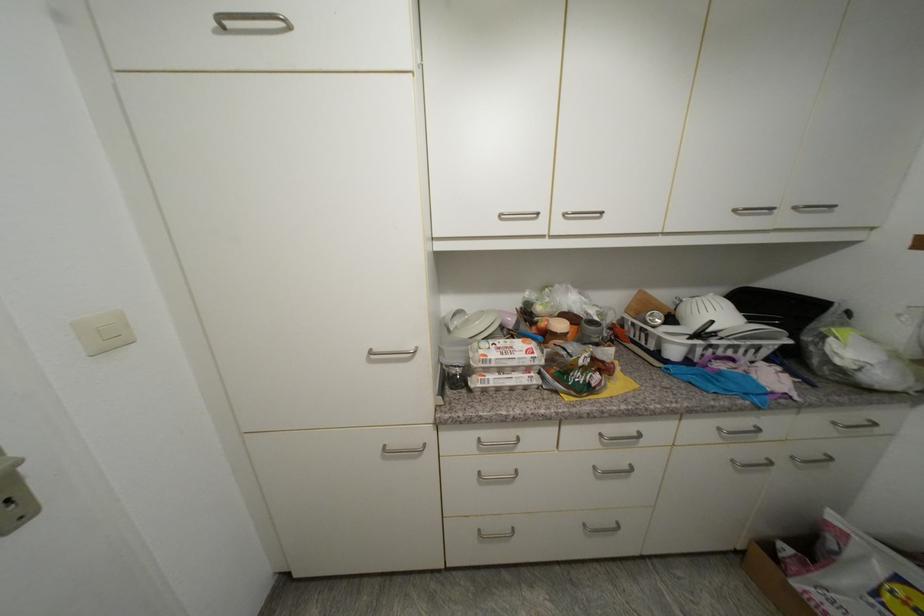
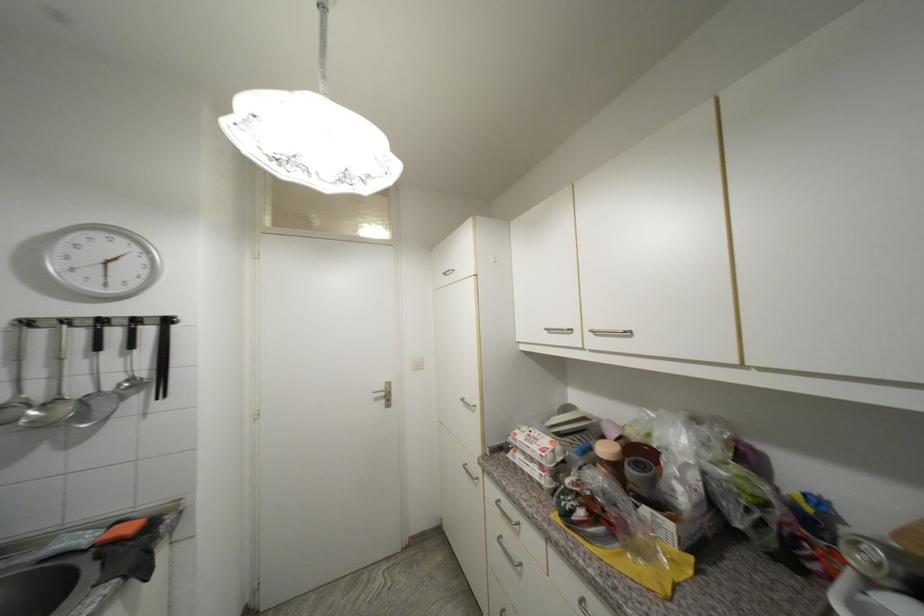
Question: The images are taken continuously from a first-person perspective. In which direction is your viewpoint rotating?

Choices:
 (A) Left
 (B) Right
 (C) Up
 (D) Down

Answer: (A)